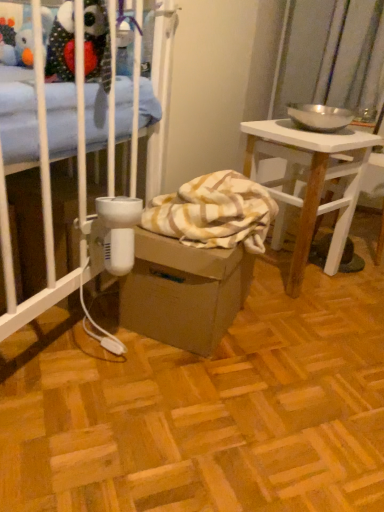
This screenshot has height=512, width=384. What are the coordinates of `vacant area that lies in front of white wood desk at right` in the screenshot? It's located at (310, 322).